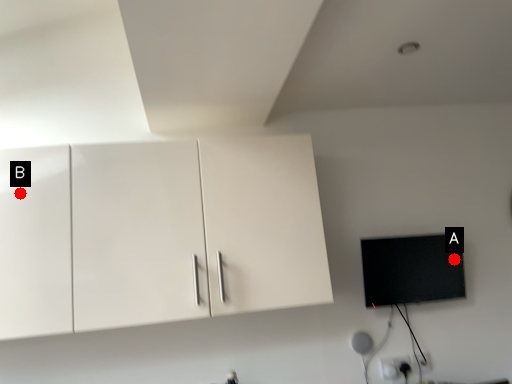
Question: Two points are circled on the image, labeled by A and B beside each circle. Which point is further to the camera?

Choices:
 (A) A is further
 (B) B is further

Answer: (A)